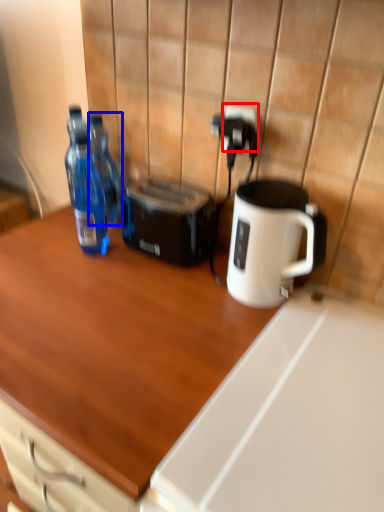
Question: Which object appears closest to the camera in this image, electric outlet (highlighted by a red box) or bottle (highlighted by a blue box)?

Choices:
 (A) electric outlet
 (B) bottle

Answer: (A)